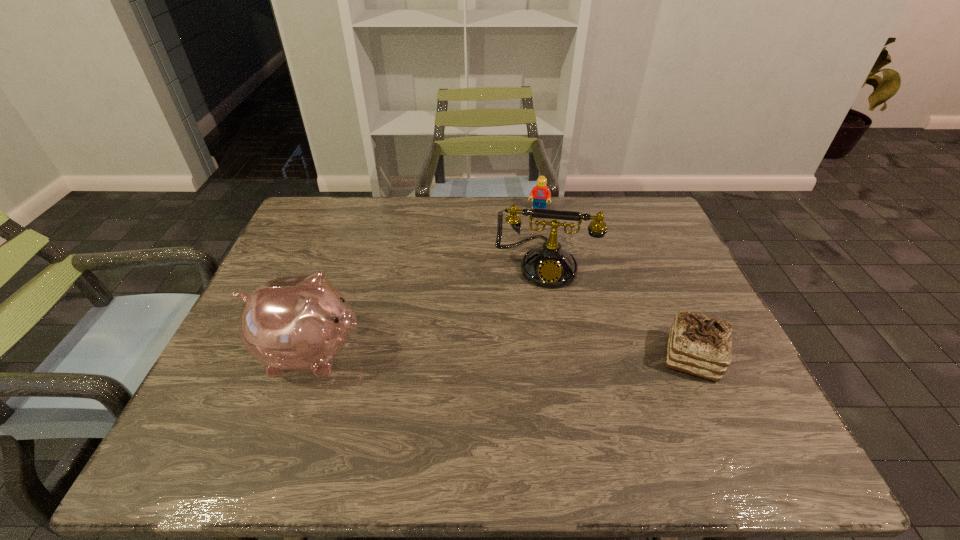
The height and width of the screenshot is (540, 960). What are the coordinates of `the leftmost object` in the screenshot? It's located at (299, 323).

Identify the location of the rightmost object. The height and width of the screenshot is (540, 960). (700, 345).

Identify the location of Lego. (540, 193).

The width and height of the screenshot is (960, 540). What are the coordinates of `telephone` in the screenshot? It's located at (549, 266).

Locate an element on the screen. blank space located on the front facing side of the piggy bank is located at coordinates pos(517,352).

Image resolution: width=960 pixels, height=540 pixels. I want to click on vacant space located 0.160m on the back of the chocolate cake, so click(661, 288).

Identify the location of vacant space positioned on the face of the Lego. (532, 235).

I want to click on vacant space situated 0.190m on the face of the Lego, so click(529, 249).

The image size is (960, 540). I want to click on vacant space located 0.400m on the face of the Lego, so click(x=518, y=298).

Locate an element on the screen. The image size is (960, 540). free space located 0.320m on the dial of the third nearest object is located at coordinates (535, 390).